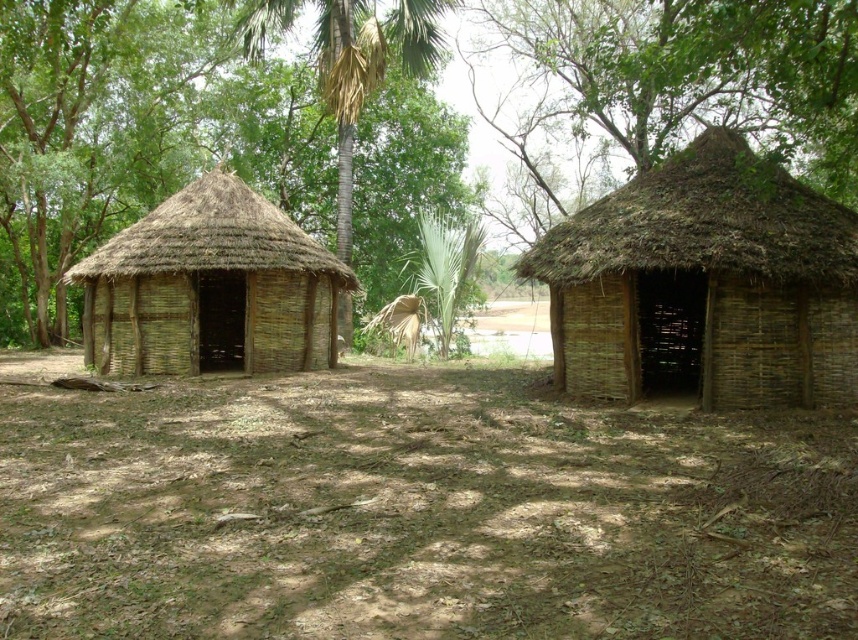
Can you confirm if brown dirt field at center is positioned above brown woven hut at left?

No.

Does point (417, 476) come farther from viewer compared to point (248, 364)?

No, (417, 476) is closer to viewer.

The image size is (858, 640). I want to click on brown dirt field at center, so click(414, 512).

Is brown woven hut at left to the right of green leafy palm tree at center from the viewer's perspective?

In fact, brown woven hut at left is to the left of green leafy palm tree at center.

Who is taller, brown woven hut at left or green leafy palm tree at center?

green leafy palm tree at center is taller.

What do you see at coordinates (210, 288) in the screenshot? Image resolution: width=858 pixels, height=640 pixels. I see `brown woven hut at left` at bounding box center [210, 288].

The image size is (858, 640). I want to click on brown woven hut at left, so click(x=210, y=288).

Who is positioned more to the left, brown thatch hut at center or green leafy palm tree at center?

green leafy palm tree at center

Is point (742, 96) behind point (360, 29)?

No, (742, 96) is closer to viewer.

You are a GUI agent. You are given a task and a screenshot of the screen. Output one action in this format:
    pyautogui.click(x=<x>, y=<y>)
    Task: Click on the brown thatch hut at center
    The height and width of the screenshot is (640, 858).
    Given the screenshot: What is the action you would take?
    pyautogui.click(x=207, y=132)